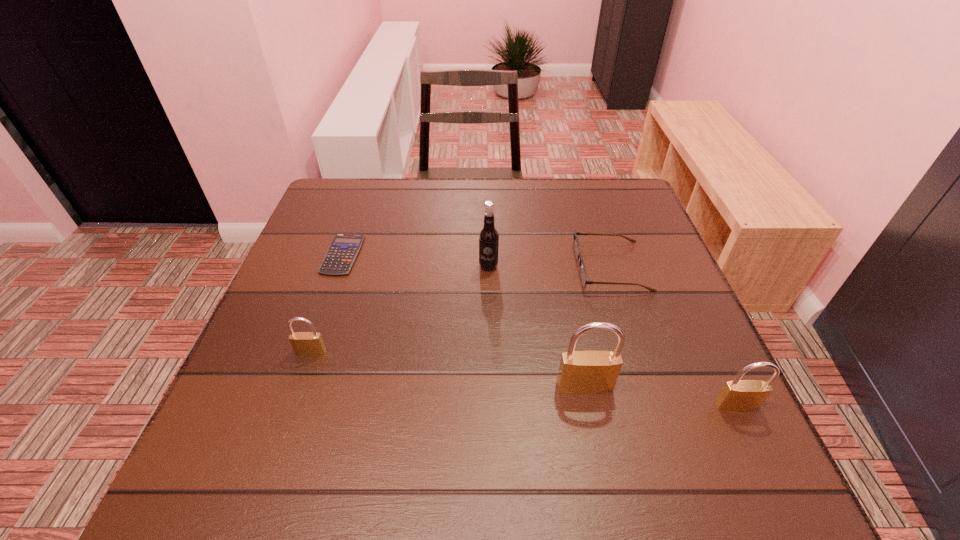
The height and width of the screenshot is (540, 960). I want to click on vacant space located 0.230m on the back of the shortest object, so click(x=366, y=188).

The width and height of the screenshot is (960, 540). I want to click on vacant space located on the label of the fourth object from right to left, so click(x=489, y=291).

The image size is (960, 540). In order to click on free space located 0.230m on the front-facing side of the spectacles in this screenshot , I will do `click(481, 267)`.

Locate an element on the screen. free space located on the front-facing side of the spectacles is located at coordinates (493, 267).

Where is `free space located 0.170m on the front-facing side of the spectacles`? The image size is (960, 540). free space located 0.170m on the front-facing side of the spectacles is located at coordinates (506, 267).

This screenshot has width=960, height=540. In order to click on padlock that is at the left edge in this screenshot , I will do `click(304, 343)`.

Locate an element on the screen. This screenshot has width=960, height=540. calculator positioned at the left edge is located at coordinates (343, 250).

The height and width of the screenshot is (540, 960). Find the location of `padlock present at the right edge`. padlock present at the right edge is located at coordinates (738, 395).

Where is `spectacles positioned at the right edge`? This screenshot has height=540, width=960. spectacles positioned at the right edge is located at coordinates (583, 274).

You are a GUI agent. You are given a task and a screenshot of the screen. Output one action in this format:
    pyautogui.click(x=<x>, y=<y>)
    Task: Click on the object located in the near right corner section of the desktop
    The width and height of the screenshot is (960, 540).
    Given the screenshot: What is the action you would take?
    738,395